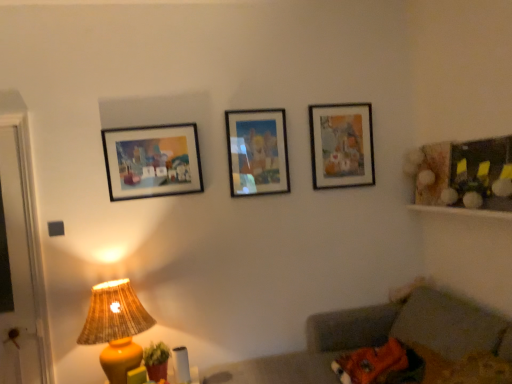
The width and height of the screenshot is (512, 384). I want to click on gray fabric couch at lower right, so click(395, 348).

This screenshot has height=384, width=512. In order to click on matte black picture frame at left, the 3th picture frame viewed from the right in this screenshot , I will do `click(152, 161)`.

The width and height of the screenshot is (512, 384). What do you see at coordinates (257, 152) in the screenshot?
I see `matte plastic picture frame at center, positioned as the 2th picture frame in front-to-back order` at bounding box center [257, 152].

This screenshot has width=512, height=384. Describe the element at coordinates (116, 327) in the screenshot. I see `yellow matte lampshade at lower left` at that location.

Find the location of a particular element. This screenshot has height=384, width=512. gray fabric couch at lower right is located at coordinates (395, 348).

Does yellow matte lampshade at lower left come in front of matte wooden picture frame at upper right, which ranks as the first picture frame in back-to-front order?

Yes, yellow matte lampshade at lower left is in front of matte wooden picture frame at upper right, which ranks as the first picture frame in back-to-front order.

Is the surface of yellow matte lampshade at lower left in direct contact with matte wooden picture frame at upper right, which ranks as the first picture frame in back-to-front order?

No, yellow matte lampshade at lower left is not making contact with matte wooden picture frame at upper right, which ranks as the first picture frame in back-to-front order.

Between yellow matte lampshade at lower left and matte wooden picture frame at upper right, the 3th picture frame when ordered from left to right, which one has more height?

With more height is yellow matte lampshade at lower left.

From the picture: From the image's perspective, relative to matte wooden picture frame at upper right, acting as the third picture frame starting from the front, is yellow matte lampshade at lower left above or below?

Clearly, from the image's perspective, yellow matte lampshade at lower left is below matte wooden picture frame at upper right, acting as the third picture frame starting from the front.

Considering the relative sizes of matte black picture frame at left, the first picture frame viewed from the front, and matte wooden picture frame at upper right, marked as the 1th picture frame in a right-to-left arrangement, in the image provided, is matte black picture frame at left, the first picture frame viewed from the front, wider than matte wooden picture frame at upper right, marked as the 1th picture frame in a right-to-left arrangement,?

Yes.

Who is shorter, matte black picture frame at left, placed as the 1th picture frame when sorted from left to right, or matte wooden picture frame at upper right, acting as the third picture frame starting from the front?

matte black picture frame at left, placed as the 1th picture frame when sorted from left to right, is shorter.

How distant is matte black picture frame at left, the 3th picture frame viewed from the right, from matte wooden picture frame at upper right, marked as the 1th picture frame in a right-to-left arrangement?

matte black picture frame at left, the 3th picture frame viewed from the right, and matte wooden picture frame at upper right, marked as the 1th picture frame in a right-to-left arrangement, are 1.01 meters apart from each other.

Can you confirm if matte black picture frame at left, the first picture frame viewed from the front, is bigger than matte wooden picture frame at upper right, marked as the 1th picture frame in a right-to-left arrangement?

Yes, matte black picture frame at left, the first picture frame viewed from the front, is bigger than matte wooden picture frame at upper right, marked as the 1th picture frame in a right-to-left arrangement.

From the picture: Is matte plastic picture frame at center, arranged as the 2th picture frame when viewed from the back, in contact with yellow matte lampshade at lower left?

No, matte plastic picture frame at center, arranged as the 2th picture frame when viewed from the back, is not touching yellow matte lampshade at lower left.

You are a GUI agent. You are given a task and a screenshot of the screen. Output one action in this format:
    pyautogui.click(x=<x>, y=<y>)
    Task: Click on the lamp lying in front of the matte plastic picture frame at center, positioned as the 2th picture frame in front-to-back order
    
    Given the screenshot: What is the action you would take?
    pyautogui.click(x=116, y=327)

Considering the positions of objects matte plastic picture frame at center, which is the 2th picture frame from right to left, and matte black picture frame at left, the 3th picture frame positioned from the back, in the image provided, who is behind, matte plastic picture frame at center, which is the 2th picture frame from right to left, or matte black picture frame at left, the 3th picture frame positioned from the back,?

matte plastic picture frame at center, which is the 2th picture frame from right to left, is more distant.

From a real-world perspective, is matte plastic picture frame at center, positioned as the 2th picture frame in front-to-back order, positioned above or below matte black picture frame at left, the 3th picture frame viewed from the right?

matte plastic picture frame at center, positioned as the 2th picture frame in front-to-back order, is above matte black picture frame at left, the 3th picture frame viewed from the right.

Looking at this image, considering the sizes of objects matte plastic picture frame at center, arranged as the 2th picture frame when viewed from the back, and matte black picture frame at left, the first picture frame viewed from the front, in the image provided, who is shorter, matte plastic picture frame at center, arranged as the 2th picture frame when viewed from the back, or matte black picture frame at left, the first picture frame viewed from the front,?

Standing shorter between the two is matte black picture frame at left, the first picture frame viewed from the front.

This screenshot has height=384, width=512. What are the coordinates of `picture frame beneath the matte plastic picture frame at center, the second picture frame viewed from the left (from a real-world perspective)` in the screenshot? It's located at (152, 161).

Does wooden frame at right appear on the left side of matte black picture frame at left, the first picture frame viewed from the front?

In fact, wooden frame at right is to the right of matte black picture frame at left, the first picture frame viewed from the front.

Is wooden frame at right facing away from matte black picture frame at left, placed as the 1th picture frame when sorted from left to right?

No, wooden frame at right's orientation is not away from matte black picture frame at left, placed as the 1th picture frame when sorted from left to right.

In the scene shown: From a real-world perspective, between wooden frame at right and matte black picture frame at left, the 3th picture frame viewed from the right, who is vertically higher?

In real-world perspective, matte black picture frame at left, the 3th picture frame viewed from the right, is above.

Where is `decorative picture lying below the matte black picture frame at left, placed as the 1th picture frame when sorted from left to right (from the image's perspective)`? The image size is (512, 384). decorative picture lying below the matte black picture frame at left, placed as the 1th picture frame when sorted from left to right (from the image's perspective) is located at coordinates (464, 174).

Can you confirm if matte wooden picture frame at upper right, which ranks as the first picture frame in back-to-front order, is smaller than yellow matte lampshade at lower left?

Correct, matte wooden picture frame at upper right, which ranks as the first picture frame in back-to-front order, occupies less space than yellow matte lampshade at lower left.

Is matte wooden picture frame at upper right, marked as the 1th picture frame in a right-to-left arrangement, wider or thinner than yellow matte lampshade at lower left?

Considering their sizes, matte wooden picture frame at upper right, marked as the 1th picture frame in a right-to-left arrangement, looks slimmer than yellow matte lampshade at lower left.

Is matte wooden picture frame at upper right, marked as the 1th picture frame in a right-to-left arrangement, positioned beyond the bounds of yellow matte lampshade at lower left?

matte wooden picture frame at upper right, marked as the 1th picture frame in a right-to-left arrangement, is positioned outside yellow matte lampshade at lower left.

Is point (344, 156) positioned behind point (120, 348)?

That is True.

From the picture: In terms of size, does wooden frame at right appear bigger or smaller than yellow matte lampshade at lower left?

Clearly, wooden frame at right is smaller in size than yellow matte lampshade at lower left.

Can you tell me how much wooden frame at right and yellow matte lampshade at lower left differ in facing direction?

87.9 degrees.

Considering the relative sizes of wooden frame at right and yellow matte lampshade at lower left in the image provided, is wooden frame at right wider than yellow matte lampshade at lower left?

Incorrect, the width of wooden frame at right does not surpass that of yellow matte lampshade at lower left.

Find the location of `the 3rd picture frame counting from the right of the yellow matte lampshade at lower left`. the 3rd picture frame counting from the right of the yellow matte lampshade at lower left is located at coordinates (341, 145).

Locate an element on the screen. This screenshot has height=384, width=512. the 2nd picture frame above the matte black picture frame at left, placed as the 1th picture frame when sorted from left to right (from a real-world perspective) is located at coordinates (341, 145).

Considering their positions, is matte black picture frame at left, the 3th picture frame viewed from the right, positioned closer to wooden frame at right than matte plastic picture frame at center, arranged as the 2th picture frame when viewed from the back?

matte plastic picture frame at center, arranged as the 2th picture frame when viewed from the back, is positioned closer to the anchor wooden frame at right.

When comparing their distances from matte plastic picture frame at center, which is the 2th picture frame from right to left, does gray fabric couch at lower right or matte black picture frame at left, the 3th picture frame viewed from the right, seem closer?

matte black picture frame at left, the 3th picture frame viewed from the right, is positioned closer to the anchor matte plastic picture frame at center, which is the 2th picture frame from right to left.

Looking at the image, which one is located closer to matte wooden picture frame at upper right, acting as the third picture frame starting from the front, matte plastic picture frame at center, arranged as the 2th picture frame when viewed from the back, or wooden frame at right?

matte plastic picture frame at center, arranged as the 2th picture frame when viewed from the back, lies closer to matte wooden picture frame at upper right, acting as the third picture frame starting from the front, than the other object.

From the image, which object appears to be nearer to wooden frame at right, gray fabric couch at lower right or matte plastic picture frame at center, which is the 2th picture frame from right to left?

gray fabric couch at lower right is positioned closer to the anchor wooden frame at right.

Based on their spatial positions, is wooden frame at right or gray fabric couch at lower right further from matte plastic picture frame at center, the second picture frame viewed from the left?

gray fabric couch at lower right is positioned further to the anchor matte plastic picture frame at center, the second picture frame viewed from the left.

Based on their spatial positions, is matte black picture frame at left, the first picture frame viewed from the front, or yellow matte lampshade at lower left further from wooden frame at right?

yellow matte lampshade at lower left is positioned further to the anchor wooden frame at right.

Based on their spatial positions, is gray fabric couch at lower right or yellow matte lampshade at lower left closer to matte plastic picture frame at center, positioned as the 2th picture frame in front-to-back order?

yellow matte lampshade at lower left is closer to matte plastic picture frame at center, positioned as the 2th picture frame in front-to-back order.

Estimate the real-world distances between objects in this image. Which object is closer to gray fabric couch at lower right, matte wooden picture frame at upper right, the 3th picture frame when ordered from left to right, or matte black picture frame at left, placed as the 1th picture frame when sorted from left to right?

The object closer to gray fabric couch at lower right is matte wooden picture frame at upper right, the 3th picture frame when ordered from left to right.

I want to click on picture frame between matte plastic picture frame at center, which is the 2th picture frame from right to left, and yellow matte lampshade at lower left in the up-down direction, so click(152, 161).

Find the location of `picture frame between matte plastic picture frame at center, arranged as the 2th picture frame when viewed from the back, and wooden frame at right`. picture frame between matte plastic picture frame at center, arranged as the 2th picture frame when viewed from the back, and wooden frame at right is located at coordinates (341, 145).

You are a GUI agent. You are given a task and a screenshot of the screen. Output one action in this format:
    pyautogui.click(x=<x>, y=<y>)
    Task: Click on the decorative picture that lies between matte plastic picture frame at center, arranged as the 2th picture frame when viewed from the back, and gray fabric couch at lower right from top to bottom
    The height and width of the screenshot is (384, 512).
    Given the screenshot: What is the action you would take?
    pyautogui.click(x=464, y=174)

This screenshot has width=512, height=384. I want to click on couch between yellow matte lampshade at lower left and matte wooden picture frame at upper right, acting as the third picture frame starting from the front, from left to right, so click(395, 348).